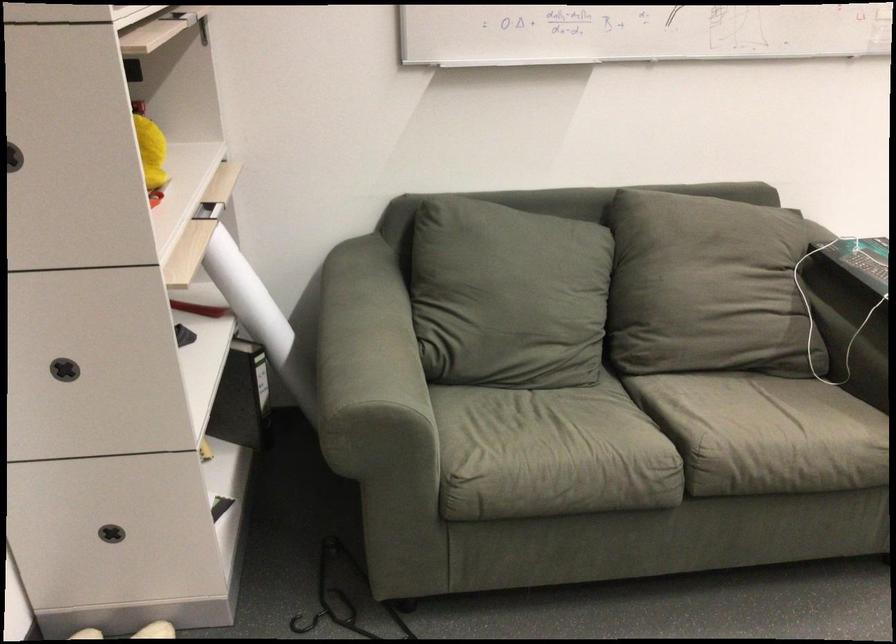
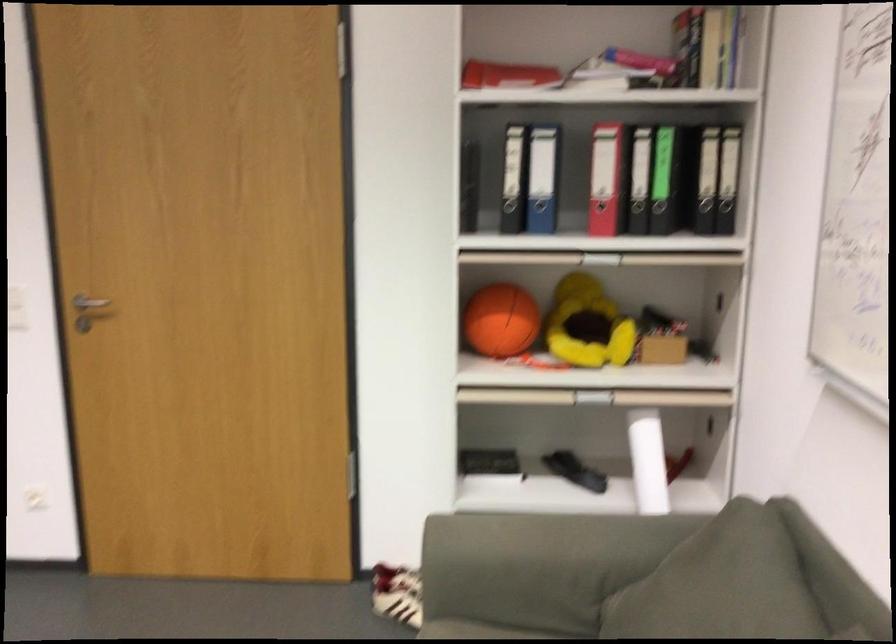
Where in the second image is the point corresponding to the point at 524,240 from the first image?

(747, 592)